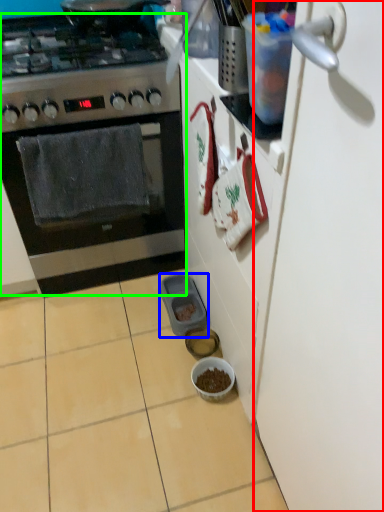
Question: Estimate the real-world distances between objects in this image. Which object is closer to door (highlighted by a red box), appliance (highlighted by a blue box) or kitchen appliance (highlighted by a green box)?

Choices:
 (A) appliance
 (B) kitchen appliance

Answer: (B)